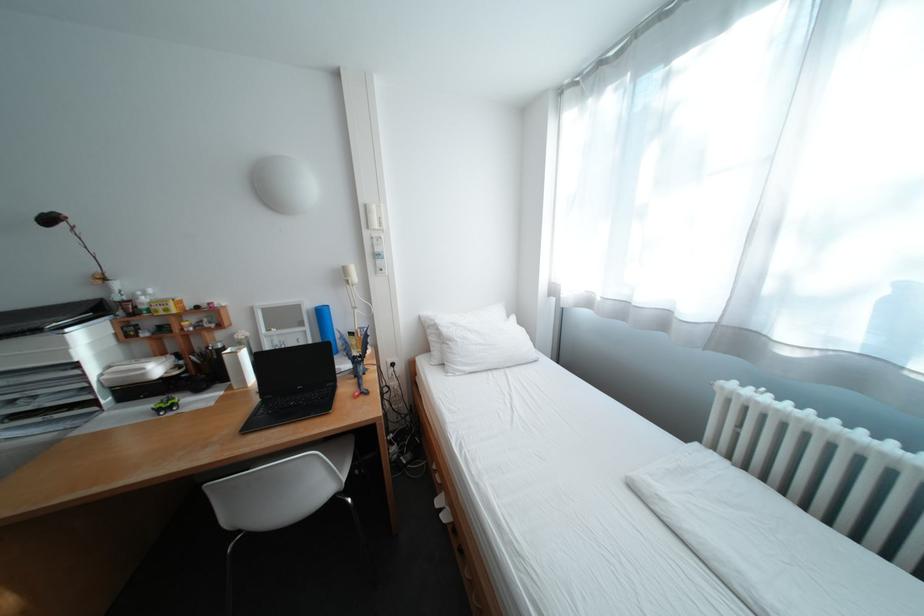
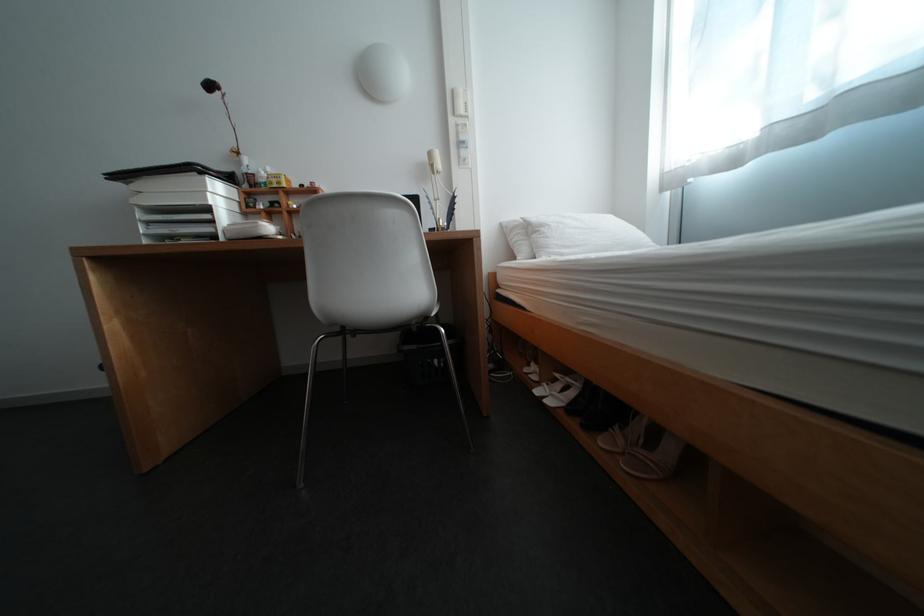
Locate, in the second image, the point that corresponds to pixel 379 207 in the first image.

(466, 92)